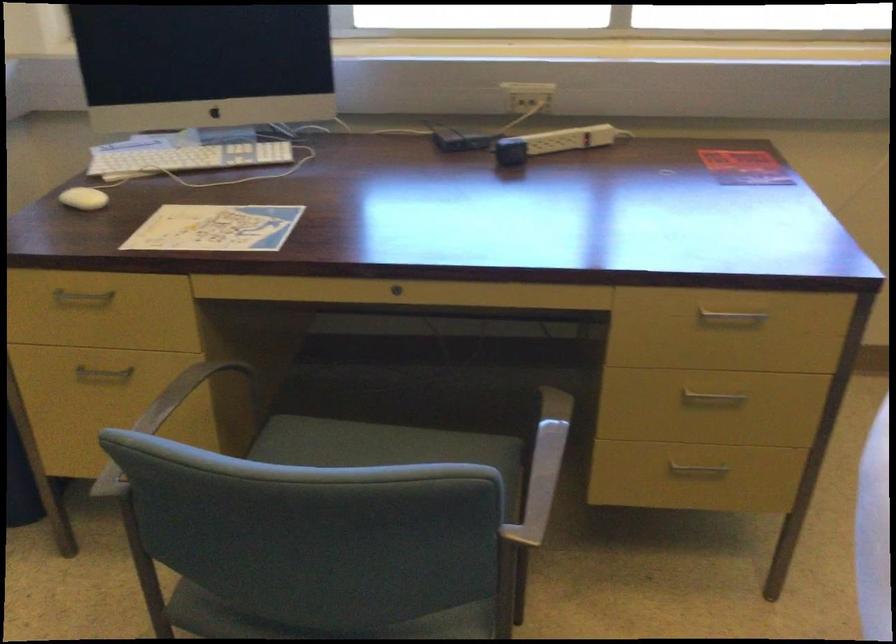
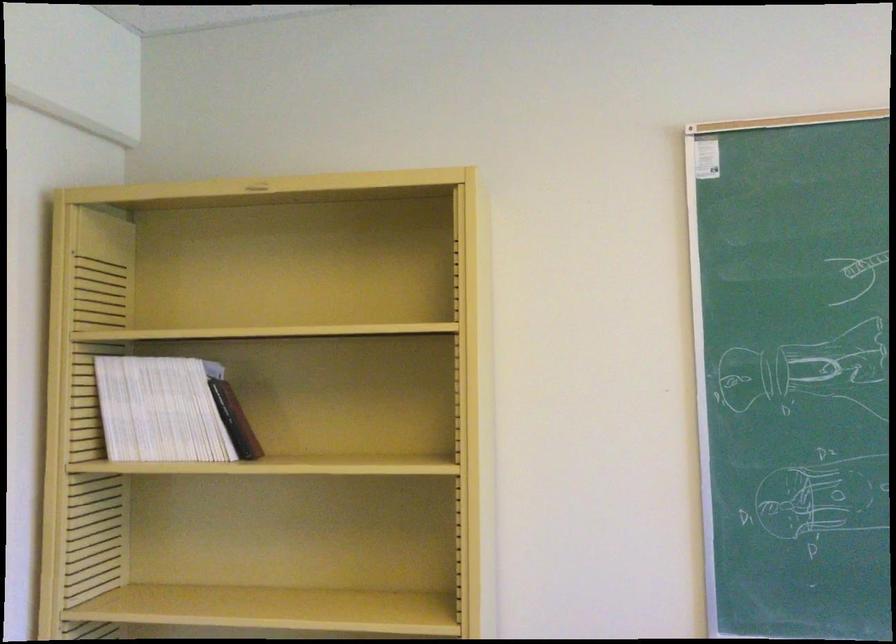
Question: The camera is either moving clockwise (left) or counter-clockwise (right) around the object. The first image is from the beginning of the video and the second image is from the end. Is the camera moving left or right when shooting the video?

Choices:
 (A) Left
 (B) Right

Answer: (B)